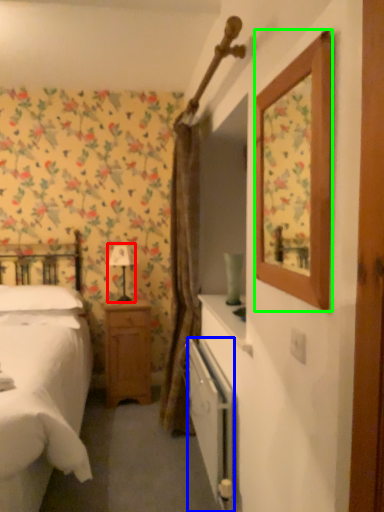
Question: Based on their relative distances, which object is farther from table lamp (highlighted by a red box)? Choose from radiator (highlighted by a blue box) and picture frame (highlighted by a green box).

Choices:
 (A) radiator
 (B) picture frame

Answer: (A)